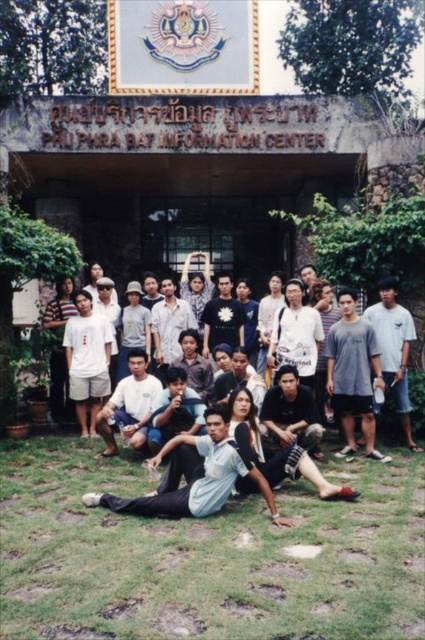
Between point (421, 561) and point (184, 474), which one is positioned behind?

Point (184, 474)

Who is more distant from viewer, (x=85, y=547) or (x=223, y=460)?

Point (x=223, y=460)

Locate an element on the screen. The height and width of the screenshot is (640, 425). green grass at lower center is located at coordinates (206, 556).